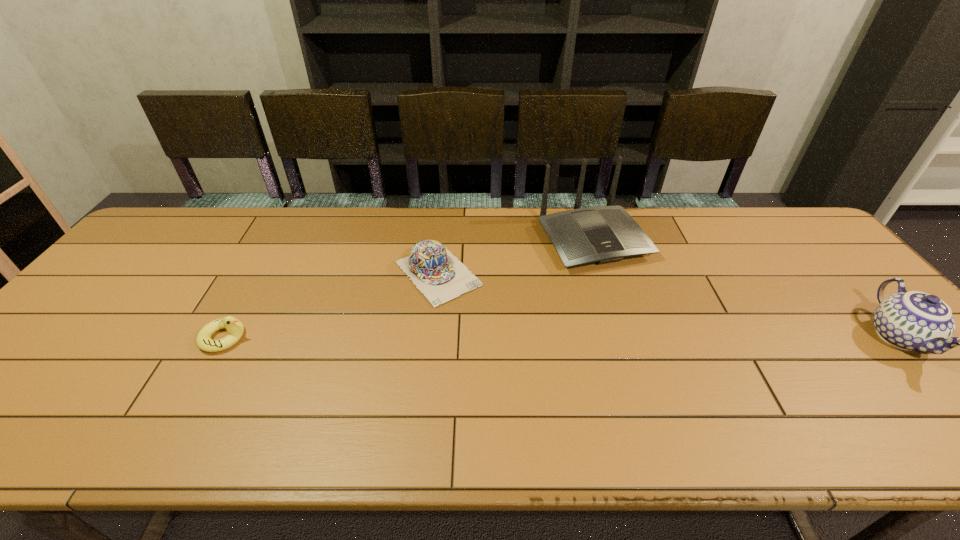
In order to click on the leftmost object in this screenshot , I will do tap(235, 328).

At what (x,y) coordinates should I click in order to perform the action: click on cap. Please return your answer as a coordinate pair (x, y). The image size is (960, 540). Looking at the image, I should click on (438, 274).

Where is `the tallest object`? The height and width of the screenshot is (540, 960). the tallest object is located at coordinates (604, 234).

This screenshot has width=960, height=540. Find the location of `the third object from left to right`. the third object from left to right is located at coordinates pos(604,234).

The height and width of the screenshot is (540, 960). Identify the location of vacant space positioned 0.320m on the face of the leftmost object. (376, 338).

At what (x,y) coordinates should I click in order to perform the action: click on free region located 0.110m on the front, side, and top of the second object from left to right. Please return your answer as a coordinate pair (x, y). The height and width of the screenshot is (540, 960). Looking at the image, I should click on (486, 327).

At what (x,y) coordinates should I click in order to perform the action: click on vacant point located 0.380m on the front, side, and top of the second object from left to right. Please return your answer as a coordinate pair (x, y). Looking at the image, I should click on (558, 404).

Where is `vacant area situated 0.060m on the front, side, and top of the second object from left to right`? This screenshot has height=540, width=960. vacant area situated 0.060m on the front, side, and top of the second object from left to right is located at coordinates (475, 315).

Where is `free space located 0.140m on the front-facing side of the router`? free space located 0.140m on the front-facing side of the router is located at coordinates (641, 309).

The height and width of the screenshot is (540, 960). Identify the location of free space located 0.220m on the front-facing side of the router. (658, 331).